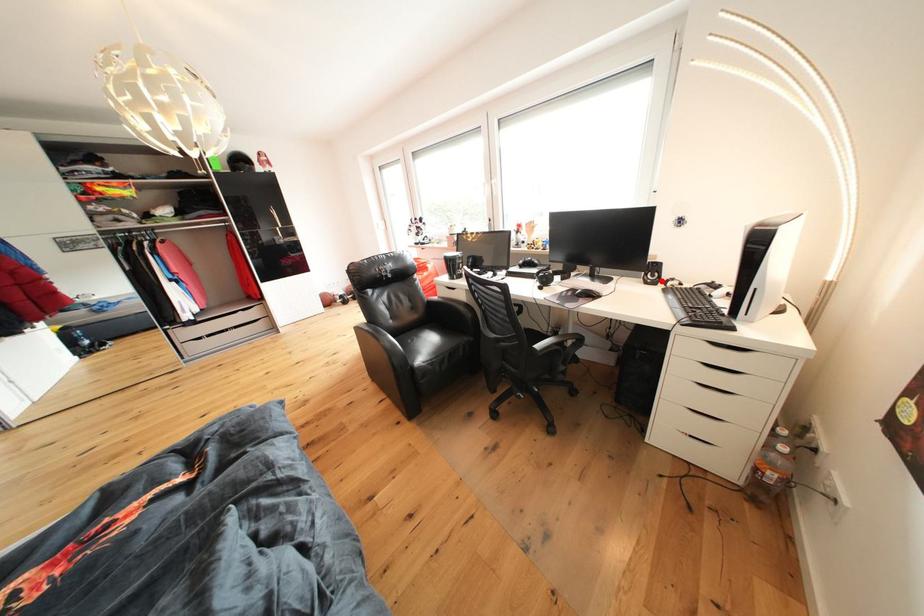
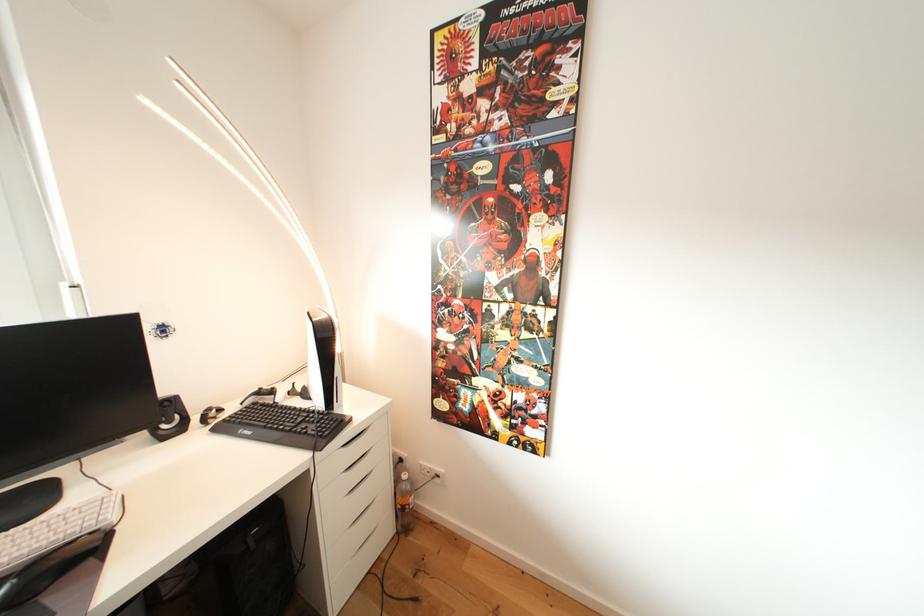
Find the pixel in the second image that matches the highlighted location in the first image.

(178, 427)